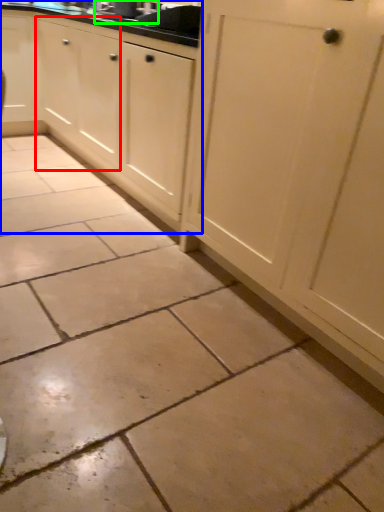
Question: Considering the real-world distances, which object is farthest from cabinetry (highlighted by a red box)? cabinetry (highlighted by a blue box) or sink (highlighted by a green box)?

Choices:
 (A) cabinetry
 (B) sink

Answer: (B)